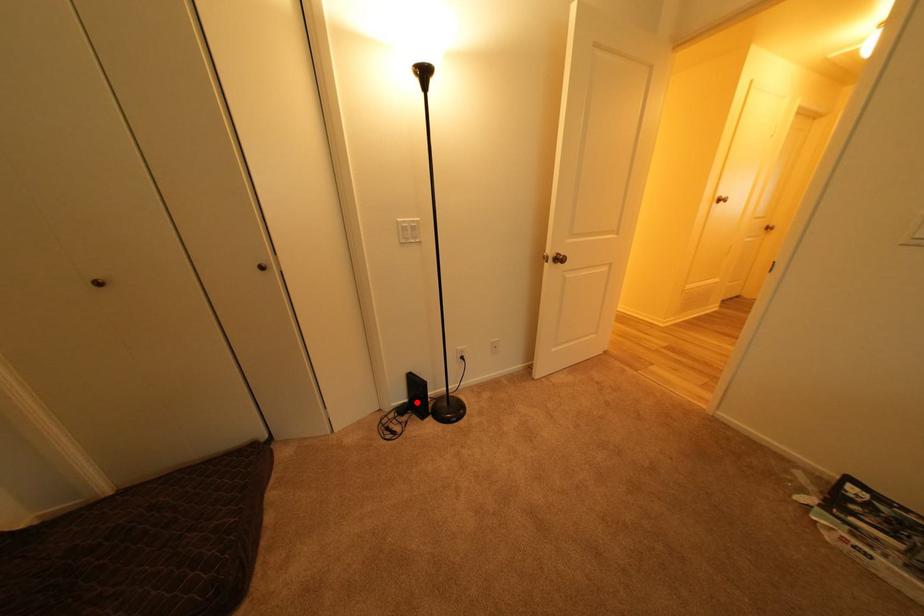
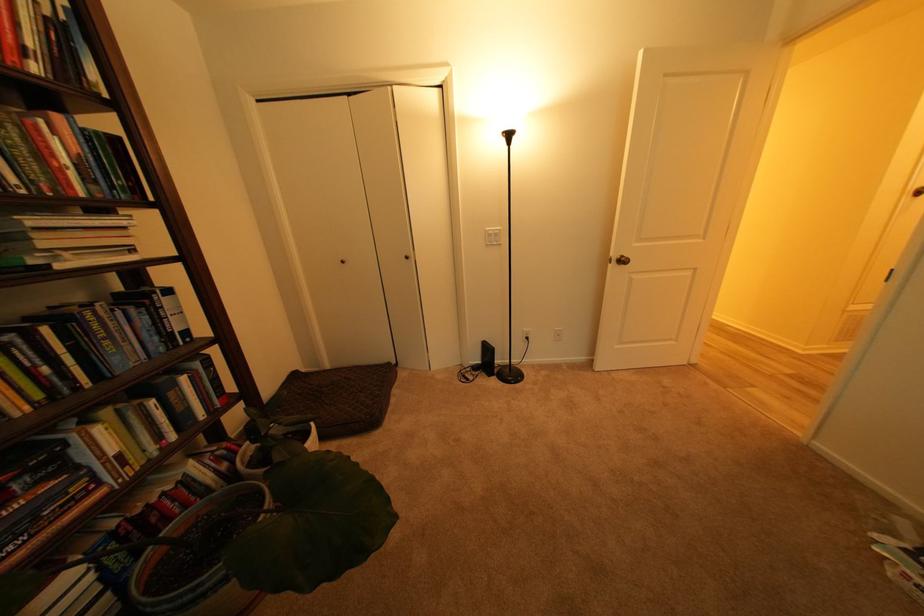
Question: I am providing you with two images of the same scene from different viewpoints. A red point is shown in image1. For the corresponding object point in image2, is it positioned nearer or farther from the camera?

Choices:
 (A) Nearer
 (B) Farther

Answer: (A)